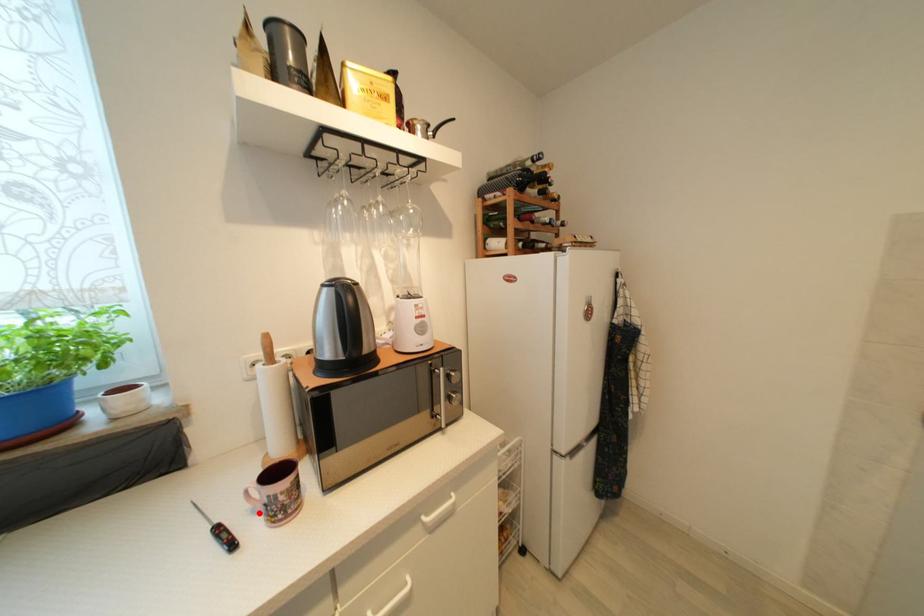
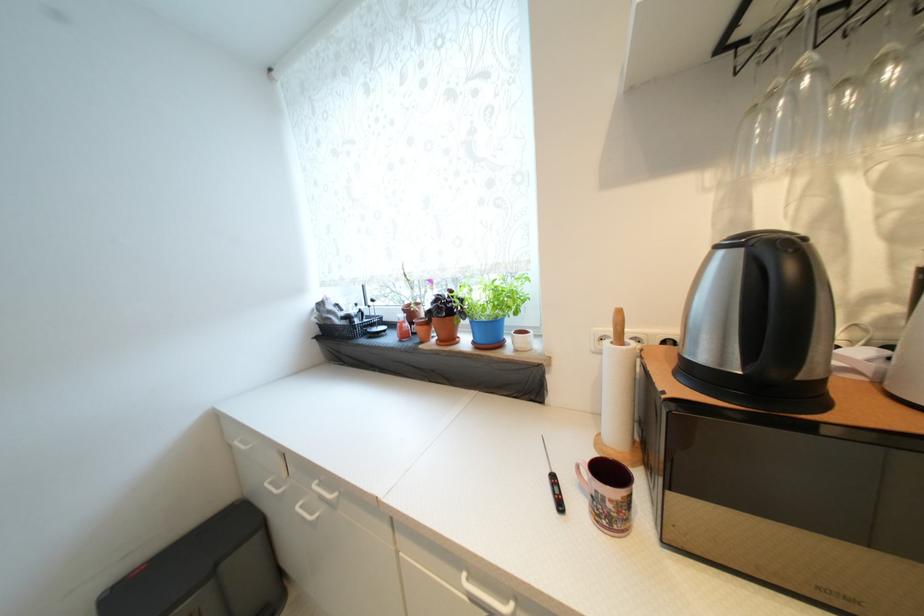
Locate, in the second image, the point that corresponds to the highlighted location in the first image.

(586, 488)